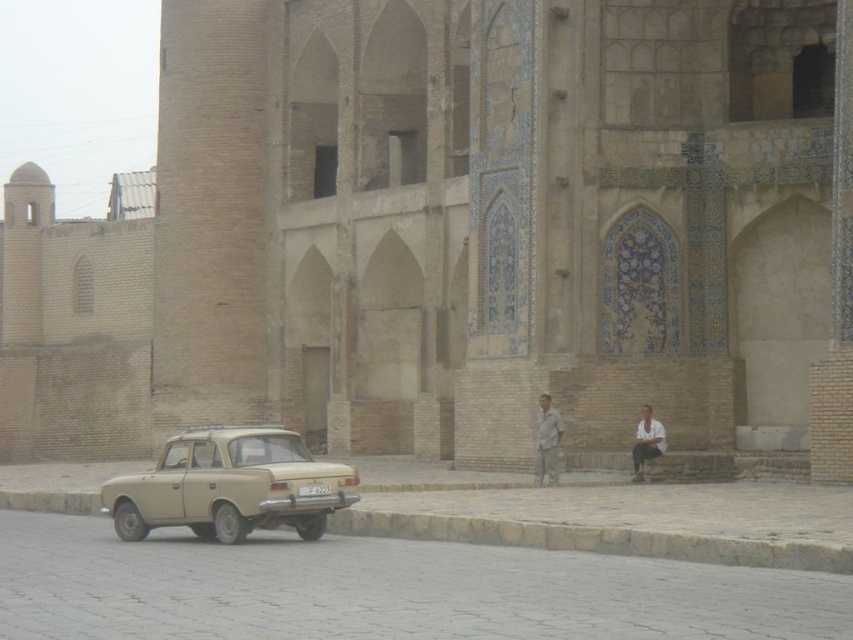
In the scene shown: You are a delivery person trying to place a package on the curb. The package is 1.2 meters wide. Can you place the package on the brown stone curb at lower center without it hanging over the edge? Consider the width of the light brown fabric shirt at lower center as a reference point.

The brown stone curb at lower center might be wider than the light brown fabric shirt at lower center. Since the package is 1.2 meters wide, if the curb is wider than the shirt, it could potentially accommodate the package. However, without knowing the exact width of the shirt, it is uncertain whether the curb is wide enough.

You are a pedestrian standing on the cobblestone street in front of the vintage car. You notice a brown stone curb at lower center and a light brown fabric shirt at lower center. Which object is positioned lower in the scene?

The brown stone curb at lower center is located below the light brown fabric shirt at lower center, so the brown stone curb at lower center is positioned lower in the scene.